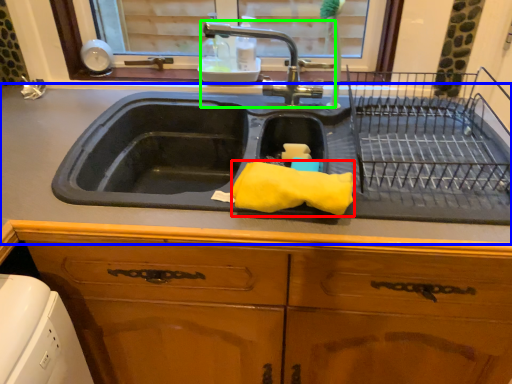
Question: Considering the real-world distances, which object is farthest from material (highlighted by a red box)? countertop (highlighted by a blue box) or tap (highlighted by a green box)?

Choices:
 (A) countertop
 (B) tap

Answer: (B)